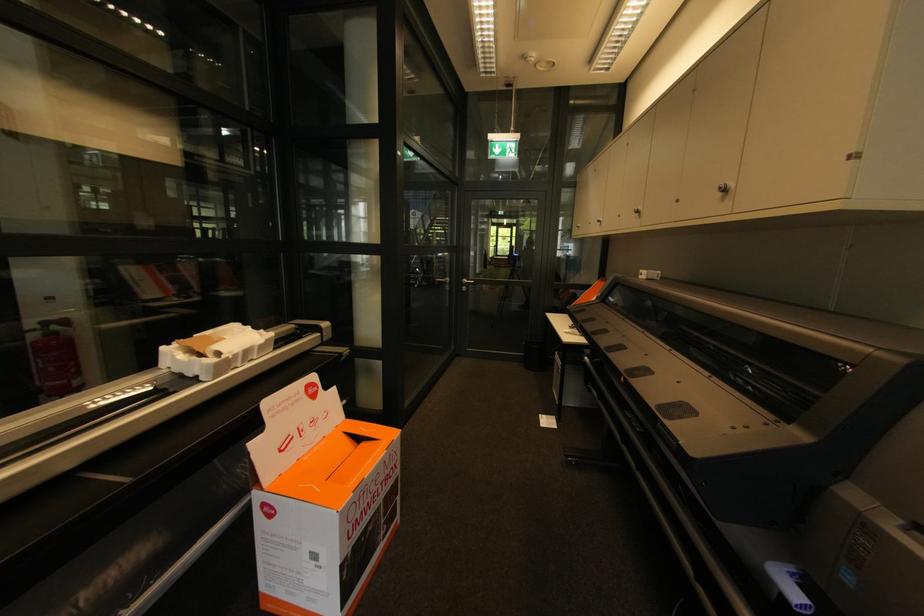
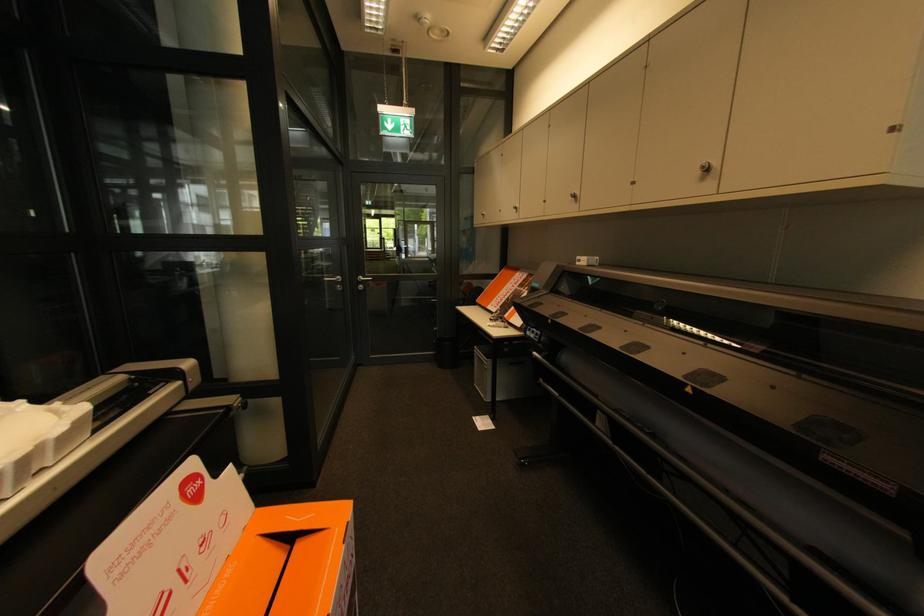
In the second image, find the point that corresponds to the point at 368,446 in the first image.

(304, 546)